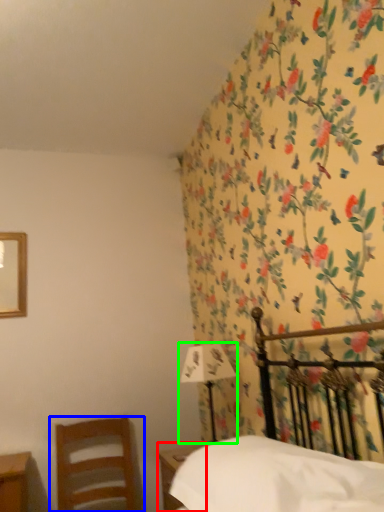
Question: Estimate the real-world distances between objects in this image. Which object is closer to nightstand (highlighted by a red box), chair (highlighted by a blue box) or bedside lamp (highlighted by a green box)?

Choices:
 (A) chair
 (B) bedside lamp

Answer: (B)